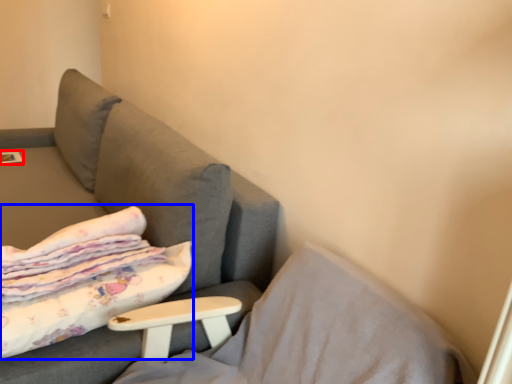
Question: Which object appears closest to the camera in this image, magazine (highlighted by a red box) or bed (highlighted by a blue box)?

Choices:
 (A) magazine
 (B) bed

Answer: (B)